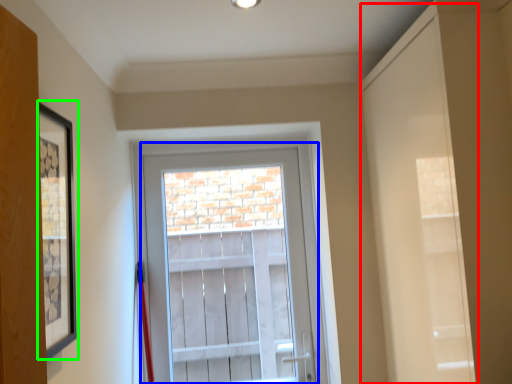
Question: Based on their relative distances, which object is nearer to door (highlighted by a red box)? Choose from glass door (highlighted by a blue box) and picture frame (highlighted by a green box).

Choices:
 (A) glass door
 (B) picture frame

Answer: (B)